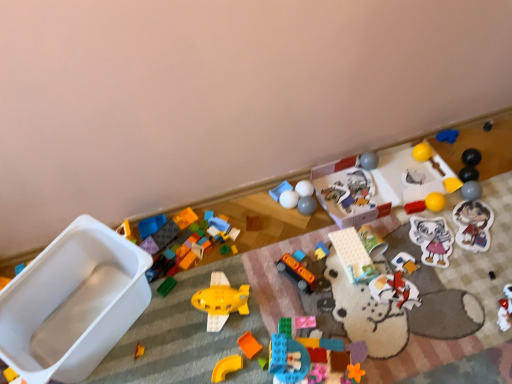
Find the location of a particular element. free space between matte plastic stickers at lower right, the 23th toy viewed from the left, and orange matte block at center, which is the twentieth toy from right to left is located at coordinates (390, 274).